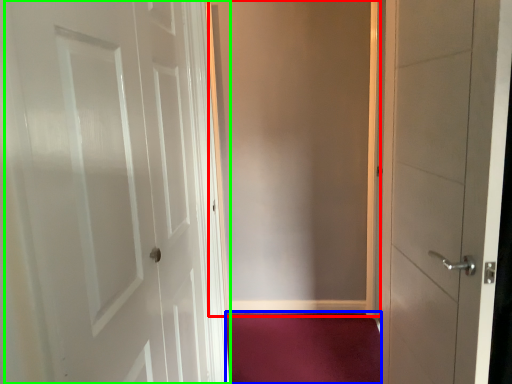
Question: Which object is positioned closest to screen door (highlighted by a red box)? Select from plain (highlighted by a blue box) and door (highlighted by a green box).

Choices:
 (A) plain
 (B) door

Answer: (A)